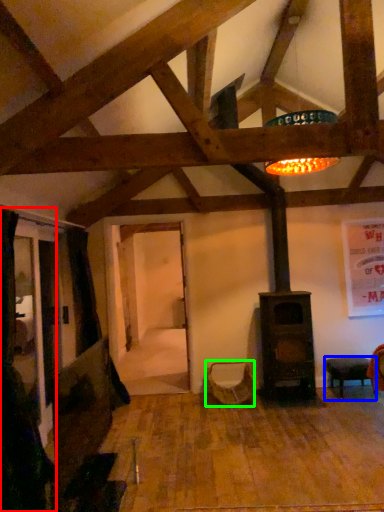
Question: Considering the real-world distances, which object is closest to curtain (highlighted by a red box)? furniture (highlighted by a blue box) or swivel chair (highlighted by a green box).

Choices:
 (A) furniture
 (B) swivel chair

Answer: (B)